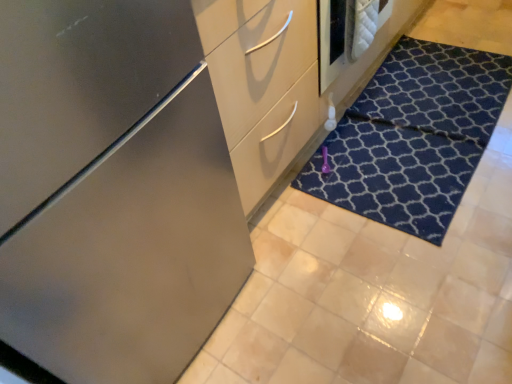
Question: Does dark blue textured doormat at lower right lie in front of satin finish cabinet at center?

Choices:
 (A) yes
 (B) no

Answer: (B)

Question: Is dark blue textured doormat at lower right shorter than satin finish cabinet at center?

Choices:
 (A) yes
 (B) no

Answer: (A)

Question: From a real-world perspective, is dark blue textured doormat at lower right on satin finish cabinet at center?

Choices:
 (A) no
 (B) yes

Answer: (A)

Question: Is dark blue textured doormat at lower right beside satin finish cabinet at center?

Choices:
 (A) no
 (B) yes

Answer: (A)

Question: Is the position of dark blue textured doormat at lower right more distant than that of satin finish cabinet at center?

Choices:
 (A) no
 (B) yes

Answer: (B)

Question: Is dark blue textured doormat at lower right taller or shorter than satin finish dresser at center?

Choices:
 (A) tall
 (B) short

Answer: (B)

Question: From the image's perspective, is dark blue textured doormat at lower right located above or below satin finish dresser at center?

Choices:
 (A) below
 (B) above

Answer: (A)

Question: Looking at their shapes, would you say dark blue textured doormat at lower right is wider or thinner than satin finish dresser at center?

Choices:
 (A) wide
 (B) thin

Answer: (A)

Question: Is dark blue textured doormat at lower right situated inside satin finish dresser at center or outside?

Choices:
 (A) outside
 (B) inside

Answer: (A)

Question: Considering the relative positions of dark blue textured doormat at lower right and satin finish cabinet at center in the image provided, is dark blue textured doormat at lower right to the left or to the right of satin finish cabinet at center?

Choices:
 (A) right
 (B) left

Answer: (A)

Question: In terms of width, does dark blue textured doormat at lower right look wider or thinner when compared to satin finish cabinet at center?

Choices:
 (A) wide
 (B) thin

Answer: (B)

Question: Is point (x=430, y=125) closer or farther from the camera than point (x=61, y=124)?

Choices:
 (A) farther
 (B) closer

Answer: (A)

Question: Considering their positions, is dark blue textured doormat at lower right located in front of or behind satin finish cabinet at center?

Choices:
 (A) front
 (B) behind

Answer: (B)

Question: Is satin finish cabinet at center wider or thinner than dark blue textured doormat at lower right?

Choices:
 (A) thin
 (B) wide

Answer: (B)

Question: From the image's perspective, relative to dark blue textured doormat at lower right, is satin finish cabinet at center above or below?

Choices:
 (A) above
 (B) below

Answer: (B)